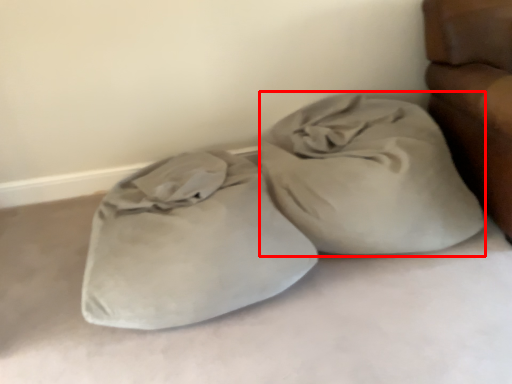
Question: Where is sack (annotated by the red box) located in relation to sleeping bag in the image?

Choices:
 (A) left
 (B) right

Answer: (B)